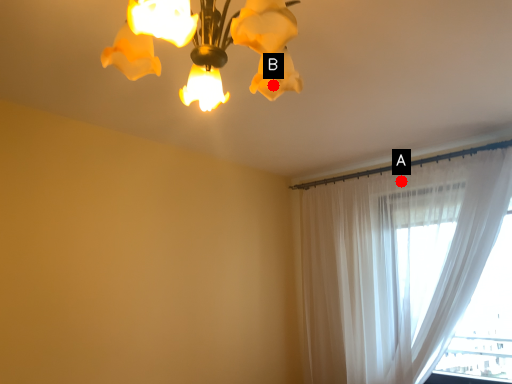
Question: Two points are circled on the image, labeled by A and B beside each circle. Among these points, which one is farthest from the camera?

Choices:
 (A) A is further
 (B) B is further

Answer: (A)